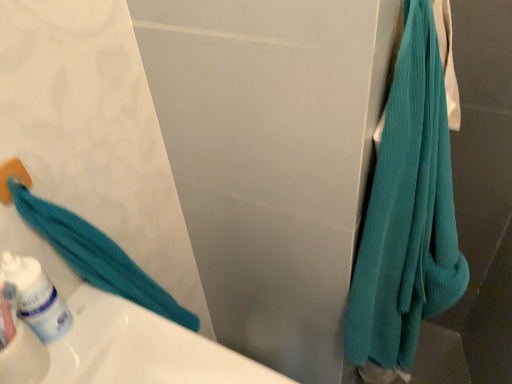
Question: Does teal ribbed towel at right have a smaller size compared to white glossy mouthwash at lower left?

Choices:
 (A) yes
 (B) no

Answer: (B)

Question: Can you confirm if teal ribbed towel at right is positioned to the left of white glossy mouthwash at lower left?

Choices:
 (A) no
 (B) yes

Answer: (A)

Question: Can you confirm if teal ribbed towel at right is taller than white glossy mouthwash at lower left?

Choices:
 (A) yes
 (B) no

Answer: (A)

Question: Is white glossy mouthwash at lower left completely or partially inside teal ribbed towel at right?

Choices:
 (A) no
 (B) yes

Answer: (A)

Question: From the image's perspective, would you say teal ribbed towel at right is shown under white glossy mouthwash at lower left?

Choices:
 (A) yes
 (B) no

Answer: (B)

Question: Is white glossy mouthwash at lower left at the back of teal ribbed towel at right?

Choices:
 (A) no
 (B) yes

Answer: (A)

Question: Does white glossy mouthwash at lower left turn towards teal ribbed towel at right?

Choices:
 (A) no
 (B) yes

Answer: (A)

Question: Is white glossy mouthwash at lower left facing away from teal ribbed towel at right?

Choices:
 (A) no
 (B) yes

Answer: (A)

Question: Is white glossy mouthwash at lower left not close to teal ribbed towel at right?

Choices:
 (A) yes
 (B) no

Answer: (B)

Question: Is white glossy mouthwash at lower left closer to the viewer compared to teal ribbed towel at right?

Choices:
 (A) yes
 (B) no

Answer: (B)

Question: From a real-world perspective, does white glossy mouthwash at lower left sit lower than teal ribbed towel at right?

Choices:
 (A) yes
 (B) no

Answer: (B)

Question: Is white glossy mouthwash at lower left taller than teal ribbed towel at right?

Choices:
 (A) no
 (B) yes

Answer: (A)

Question: Is teal ribbed towel at right in front of or behind white glossy mouthwash at lower left in the image?

Choices:
 (A) front
 (B) behind

Answer: (A)